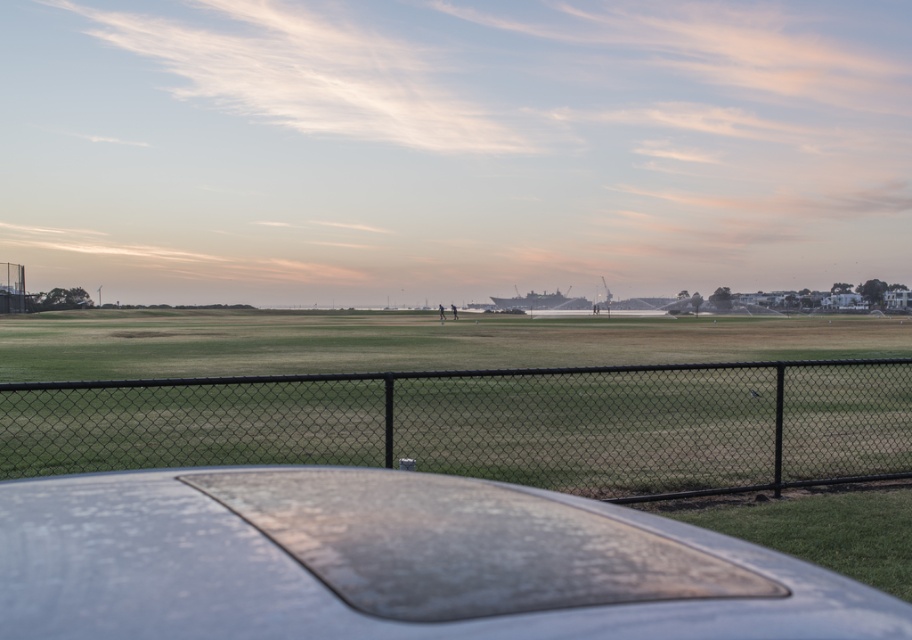
What do you see at coordinates (390, 563) in the screenshot? The height and width of the screenshot is (640, 912). I see `matte gray car at center` at bounding box center [390, 563].

Can you confirm if matte gray car at center is positioned to the right of black chain-link fence at center?

In fact, matte gray car at center is to the left of black chain-link fence at center.

Which is behind, point (130, 525) or point (286, 381)?

Positioned behind is point (286, 381).

Locate an element on the screen. The image size is (912, 640). matte gray car at center is located at coordinates [390, 563].